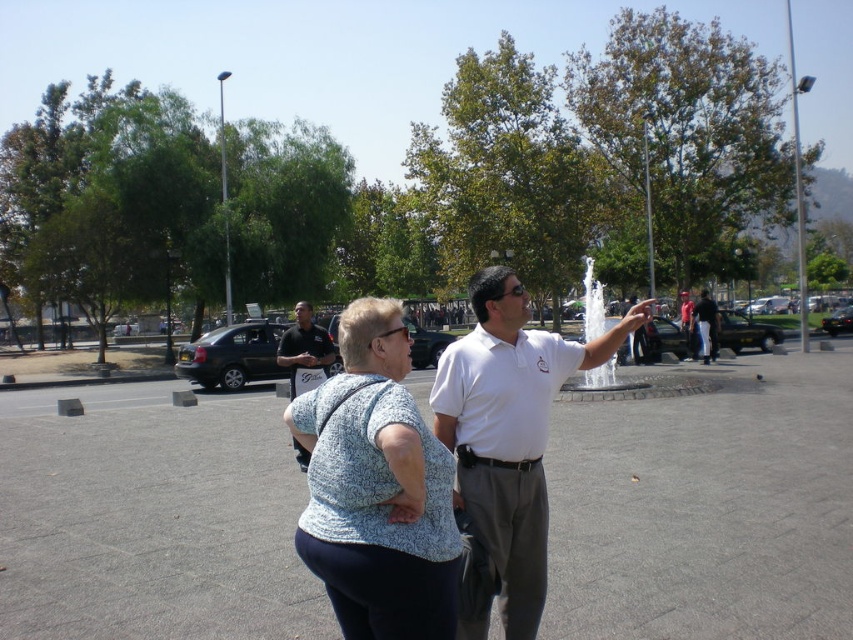
Question: Which object is positioned farthest from the white cotton shirt at center?

Choices:
 (A) clear glass fountain at center
 (B) white shirt at center
 (C) light blue fabric shirt at center

Answer: (B)

Question: Which object appears farthest from the camera in this image?

Choices:
 (A) white cotton shirt at center
 (B) clear glass fountain at center

Answer: (B)

Question: Is white cotton shirt at center positioned before white shirt at center?

Choices:
 (A) no
 (B) yes

Answer: (B)

Question: Is white cotton shirt at center to the right of white shirt at center from the viewer's perspective?

Choices:
 (A) no
 (B) yes

Answer: (A)

Question: Does clear glass fountain at center come behind light blue fabric shirt at center?

Choices:
 (A) no
 (B) yes

Answer: (A)

Question: Which point is closer to the camera?

Choices:
 (A) dark gray uniform at center
 (B) clear glass fountain at center
 (C) white cotton shirt at center

Answer: (A)